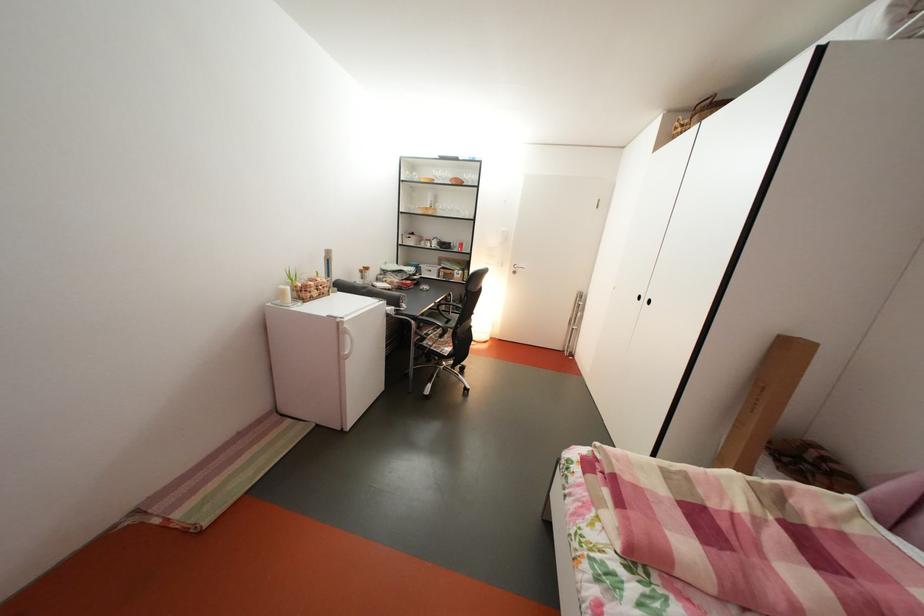
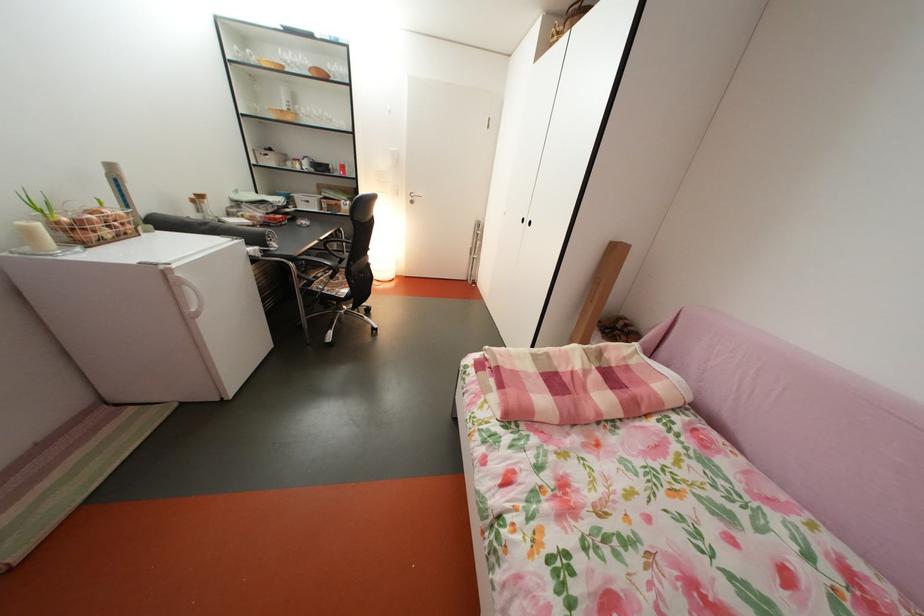
Find the pixel in the second image that matches [295,298] in the first image.

(41, 238)